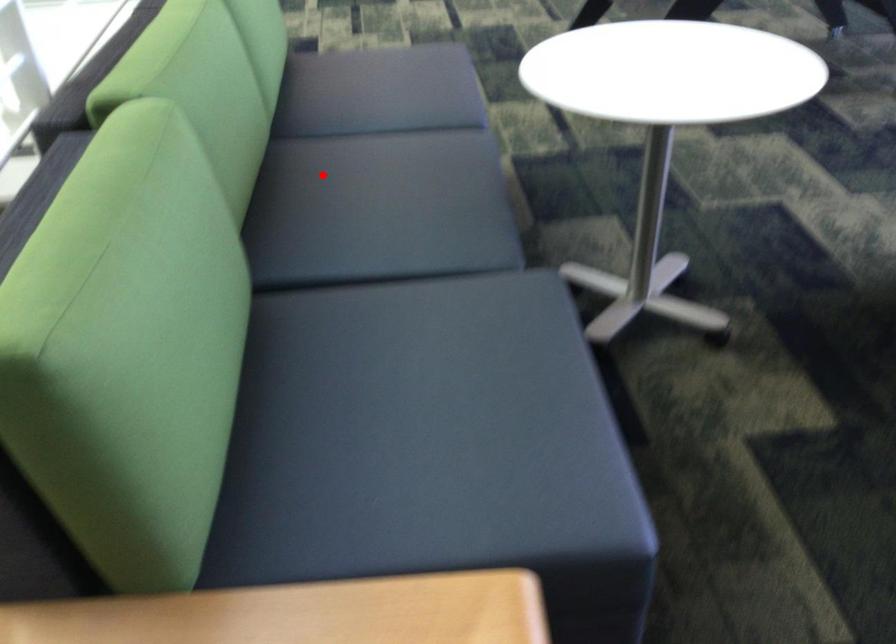
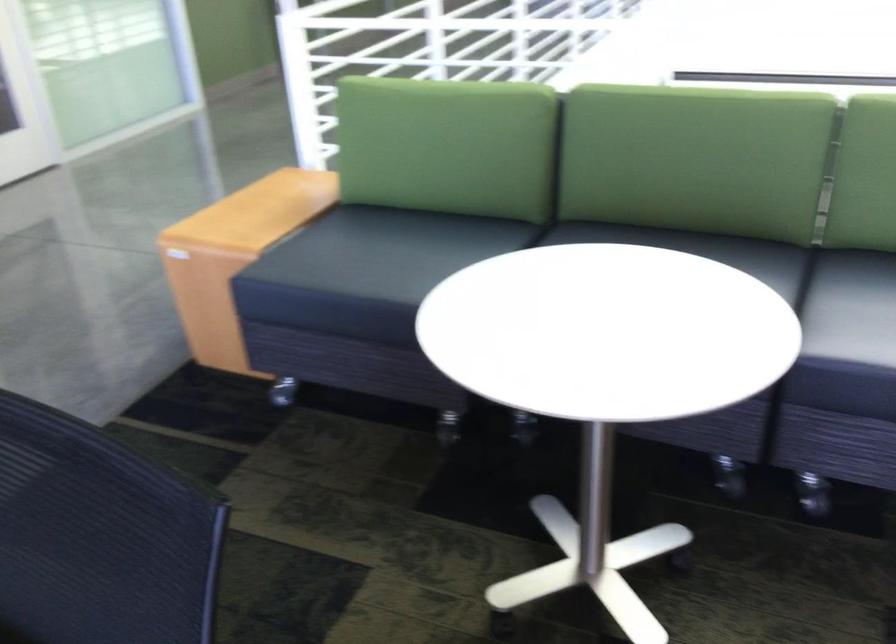
Find the pixel in the second image that matches the highlighted location in the first image.

(702, 250)